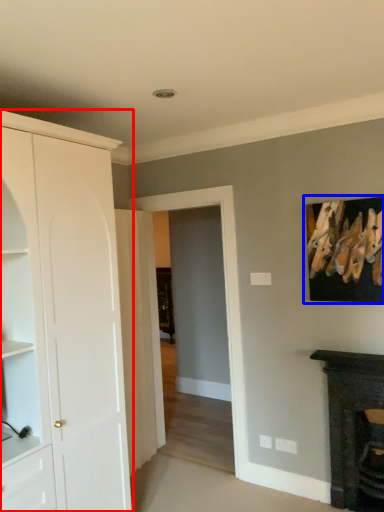
Question: Which of the following is the farthest to the observer, cabinetry (highlighted by a red box) or picture frame (highlighted by a blue box)?

Choices:
 (A) cabinetry
 (B) picture frame

Answer: (B)